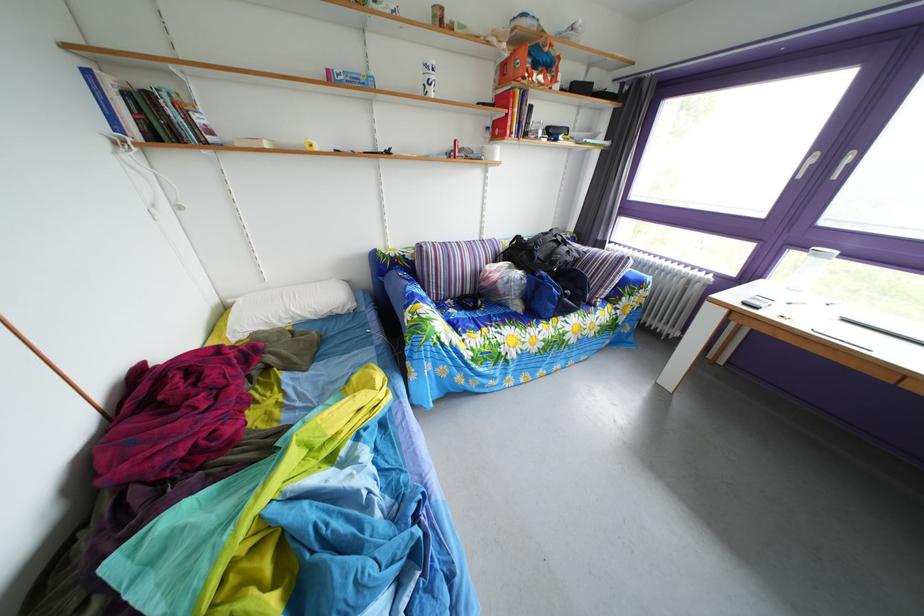
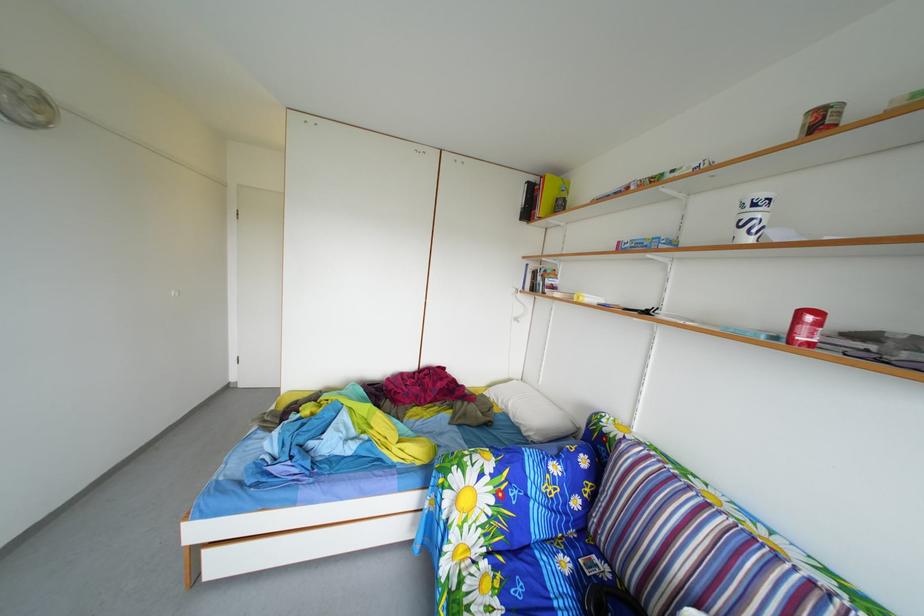
The point at [466,150] is marked in the first image. Where is the corresponding point in the second image?

(811, 321)